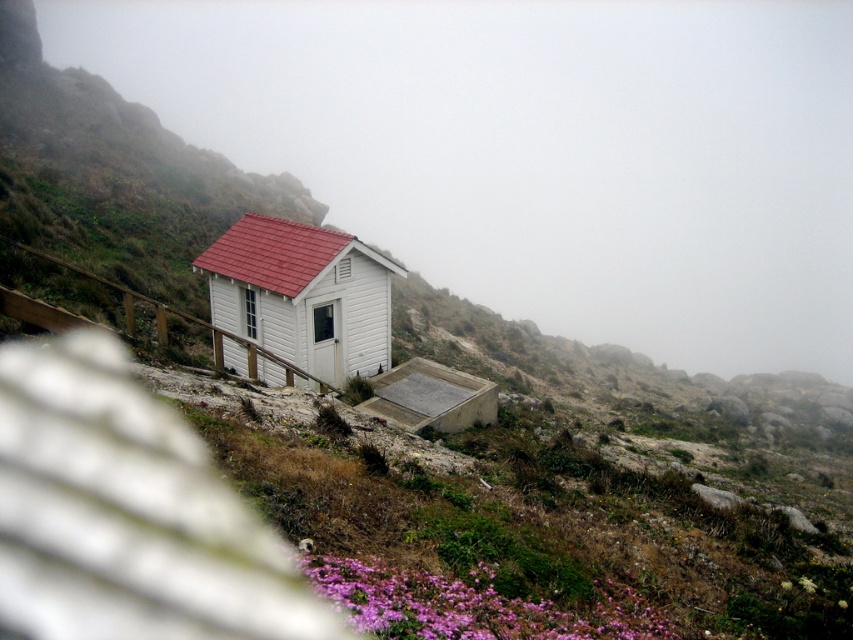
Question: Is white wood cabin at center closer to the viewer compared to purple matte flowers at lower center?

Choices:
 (A) no
 (B) yes

Answer: (A)

Question: Among these objects, which one is nearest to the camera?

Choices:
 (A) white wood cabin at center
 (B) purple matte flowers at lower center

Answer: (B)

Question: Which of the following is the closest to the observer?

Choices:
 (A) (294, 307)
 (B) (601, 620)

Answer: (B)

Question: Which point is closer to the camera taking this photo?

Choices:
 (A) (300, 285)
 (B) (669, 628)

Answer: (B)

Question: Does white wood cabin at center have a smaller size compared to purple matte flowers at lower center?

Choices:
 (A) no
 (B) yes

Answer: (B)

Question: Can you confirm if white wood cabin at center is thinner than purple matte flowers at lower center?

Choices:
 (A) yes
 (B) no

Answer: (A)